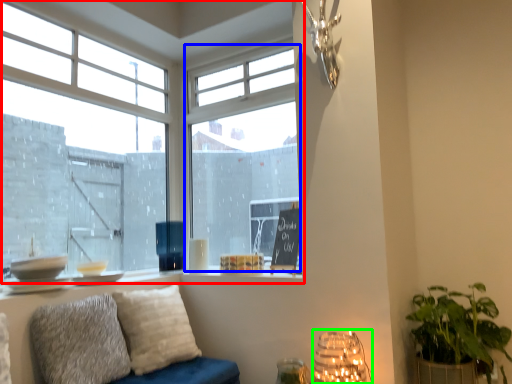
Question: Which object is positioned farthest from window (highlighted by a red box)? Select from window (highlighted by a blue box) and lamp (highlighted by a green box).

Choices:
 (A) window
 (B) lamp

Answer: (B)